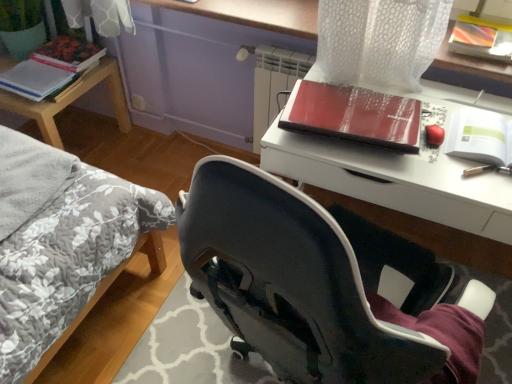
The width and height of the screenshot is (512, 384). What are the coordinates of `free spot to the left of green matte paperback book at upper right, the 3th paperback book positioned from the back` in the screenshot? It's located at (437, 158).